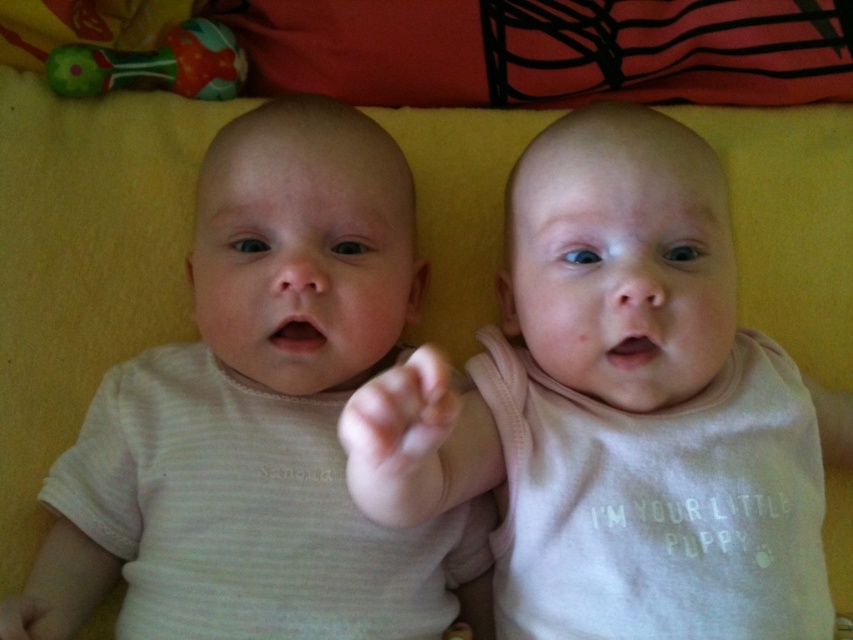
Question: Can you confirm if white ribbed fabric baby at center is positioned to the right of pink soft fabric baby at center?

Choices:
 (A) yes
 (B) no

Answer: (B)

Question: Can you confirm if white ribbed fabric baby at center is thinner than matte plastic rattle at upper left?

Choices:
 (A) no
 (B) yes

Answer: (A)

Question: Which of these objects is positioned closest to the matte plastic rattle at upper left?

Choices:
 (A) pink soft fabric baby at center
 (B) white ribbed fabric baby at center

Answer: (B)

Question: Does white ribbed fabric baby at center have a greater width compared to pink soft fabric baby at center?

Choices:
 (A) yes
 (B) no

Answer: (B)

Question: Which of the following is the closest to the observer?

Choices:
 (A) (709, 444)
 (B) (339, 144)

Answer: (A)

Question: Which of the following is the farthest from the observer?

Choices:
 (A) click(561, 486)
 (B) click(177, 35)

Answer: (B)